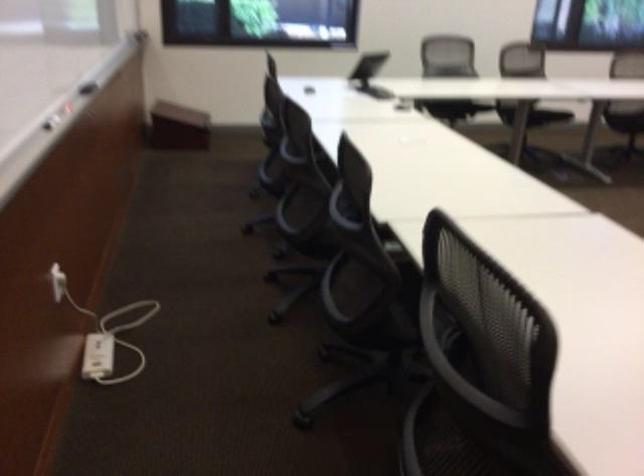
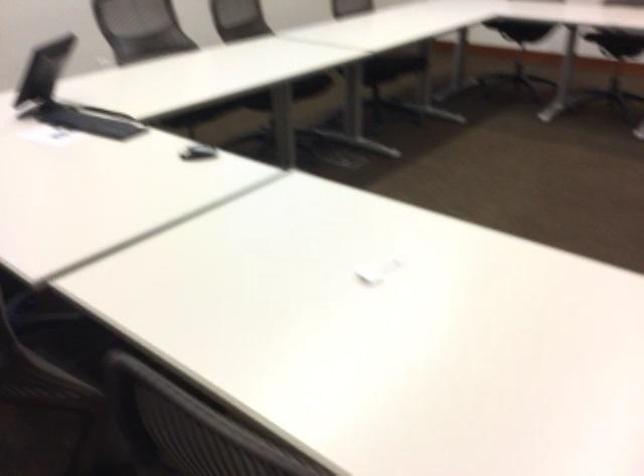
Question: The images are taken continuously from a first-person perspective. In which direction are you moving?

Choices:
 (A) Left
 (B) Right
 (C) Forward
 (D) Backward

Answer: (D)